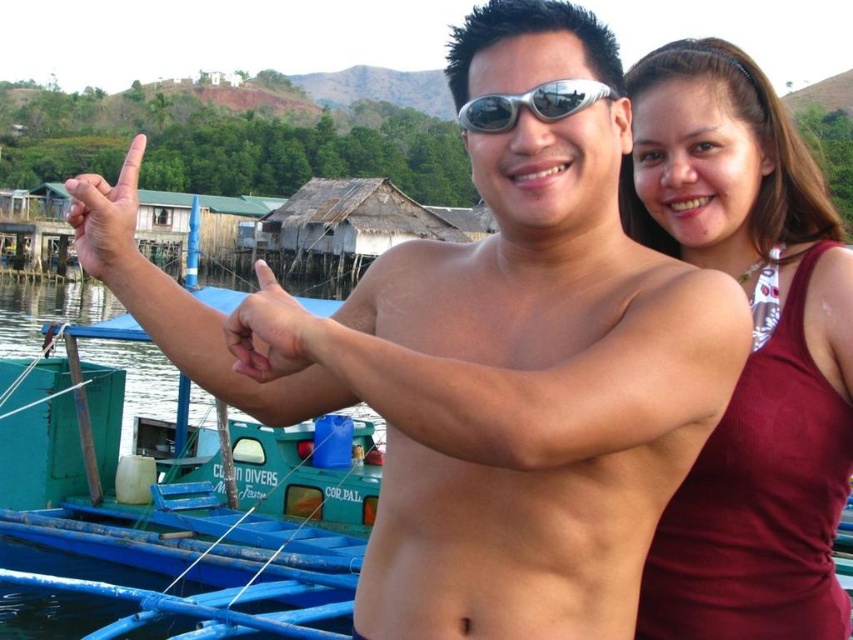
Question: Does green plastic boat at left have a lesser width compared to matte skin hand at upper left?

Choices:
 (A) no
 (B) yes

Answer: (A)

Question: Which of the following is the farthest from the observer?

Choices:
 (A) green plastic boat at left
 (B) matte skin hand at upper left
 (C) maroon fabric tank top at right
 (D) silver metallic goggles at center

Answer: (A)

Question: Is green plastic boat at left above matte skin hand at upper left?

Choices:
 (A) no
 (B) yes

Answer: (A)

Question: Does green plastic boat at left have a larger size compared to silver metallic goggles at center?

Choices:
 (A) no
 (B) yes

Answer: (B)

Question: Which is farther from the silver metallic goggles at center?

Choices:
 (A) green plastic boat at left
 (B) maroon fabric tank top at right

Answer: (A)

Question: Which point is farther to the camera?

Choices:
 (A) matte skin hand at center
 (B) green plastic boat at left
 (C) silver metallic goggles at center

Answer: (B)